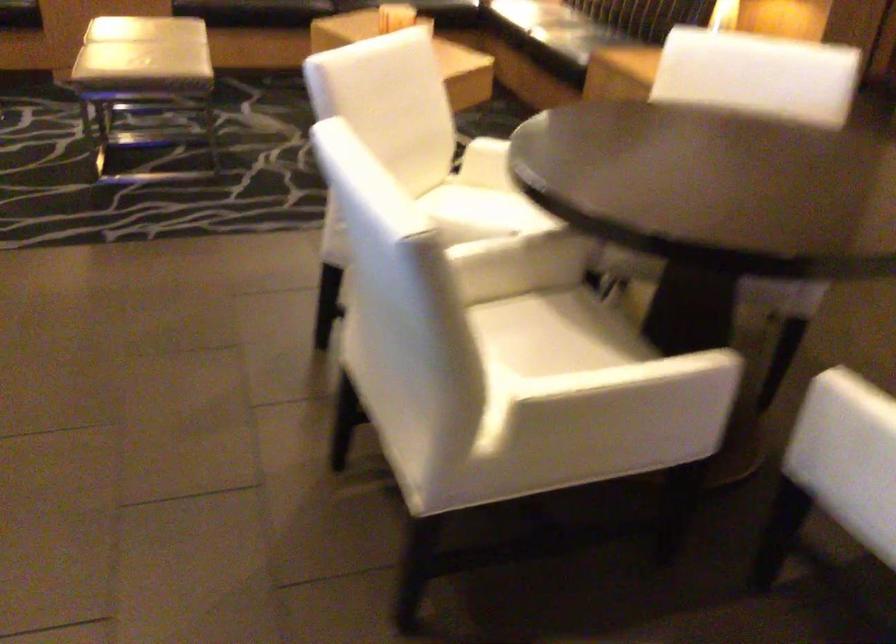
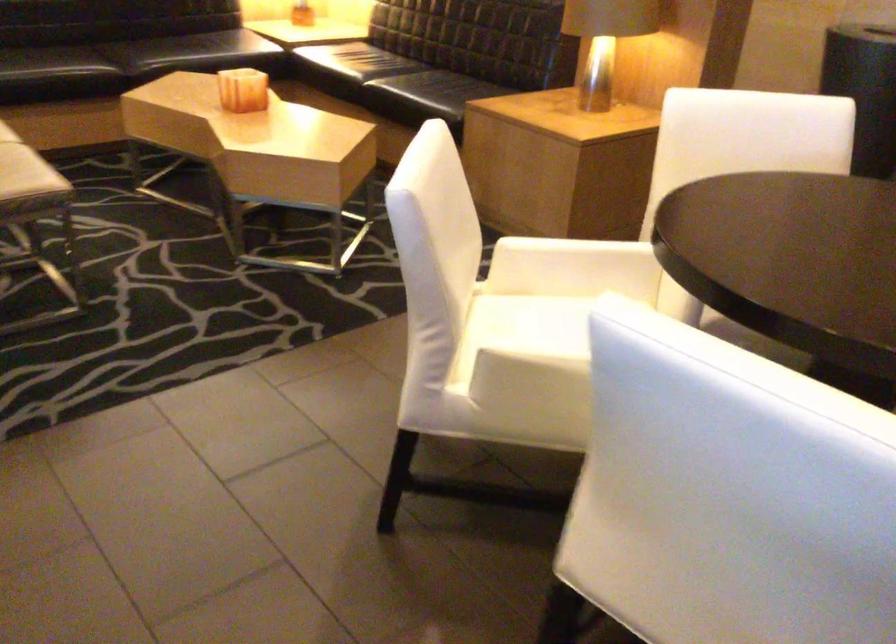
Where in the second image is the point corresponding to [483,190] from the first image?

(538, 304)